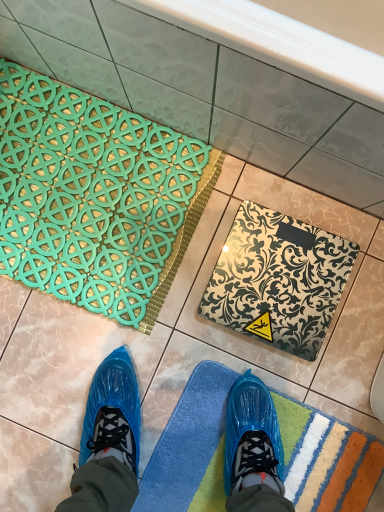
Find the location of a particular element. The width and height of the screenshot is (384, 512). empty space that is ontop of metallic silver scale at center, the 2th bath mat from the bottom (from a real-world perspective) is located at coordinates (286, 283).